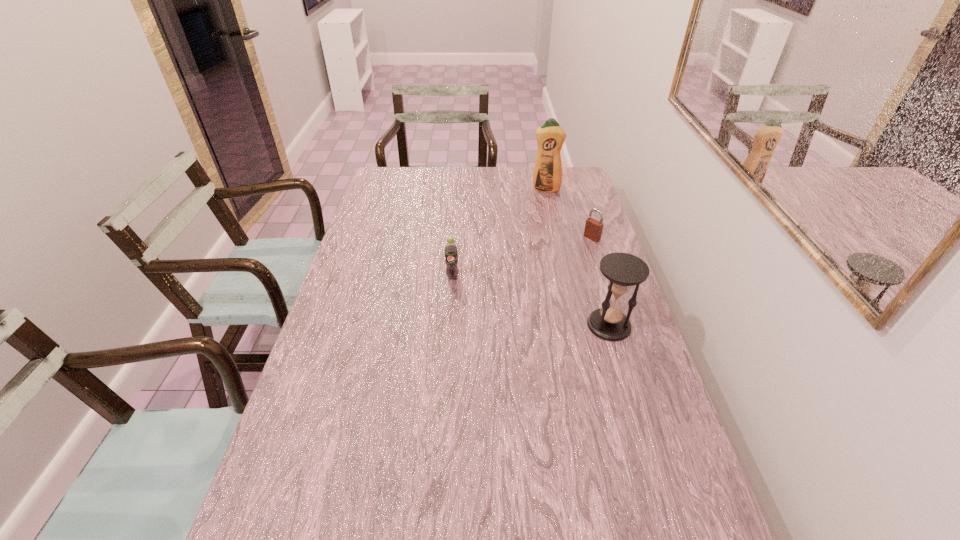
Locate an element on the screen. The image size is (960, 540). object situated at the far right corner is located at coordinates tap(547, 177).

Locate an element on the screen. The image size is (960, 540). free region at the far edge is located at coordinates (494, 188).

This screenshot has width=960, height=540. I want to click on free space at the near edge of the desktop, so click(540, 530).

Identify the location of free space at the left edge. (375, 317).

Find the location of a particular element. free location at the right edge of the desktop is located at coordinates (674, 461).

Identify the location of vacant region at the far left corner of the desktop. (400, 194).

In the image, there is a desktop. What are the coordinates of `vacant space at the near left corner` in the screenshot? It's located at (314, 521).

In the image, there is a desktop. Where is `free space at the far right corner`? This screenshot has width=960, height=540. free space at the far right corner is located at coordinates (584, 183).

In the image, there is a desktop. At what (x,y) coordinates should I click in order to perform the action: click on vacant space at the near right corner. Please return your answer as a coordinate pair (x, y). Looking at the image, I should click on (676, 497).

Find the location of a particular element. This screenshot has height=540, width=960. empty space that is in between the shortest object and the farthest object is located at coordinates (568, 213).